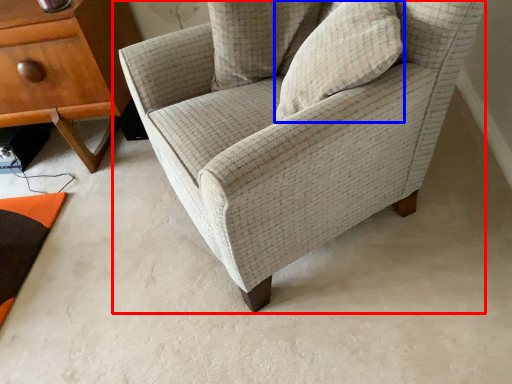
Question: Which point is further to the camera, chair (highlighted by a red box) or pillow (highlighted by a blue box)?

Choices:
 (A) chair
 (B) pillow

Answer: (B)